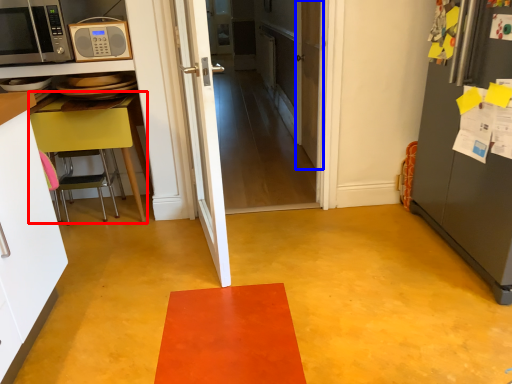
Question: Which point is further to the camera, table (highlighted by a red box) or door (highlighted by a blue box)?

Choices:
 (A) table
 (B) door

Answer: (B)